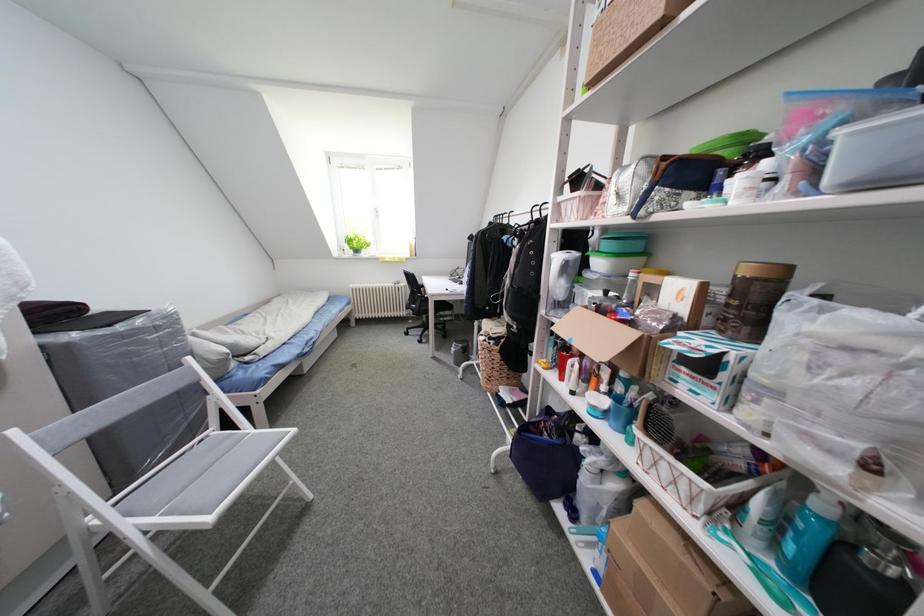
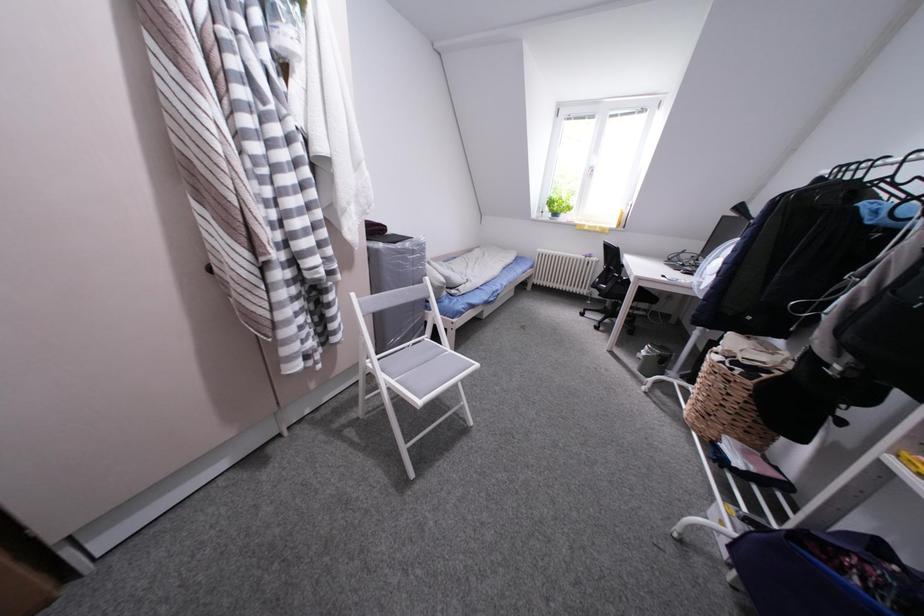
Question: The camera is either moving clockwise (left) or counter-clockwise (right) around the object. The first image is from the beginning of the video and the second image is from the end. Is the camera moving left or right when shooting the video?

Choices:
 (A) Left
 (B) Right

Answer: (B)